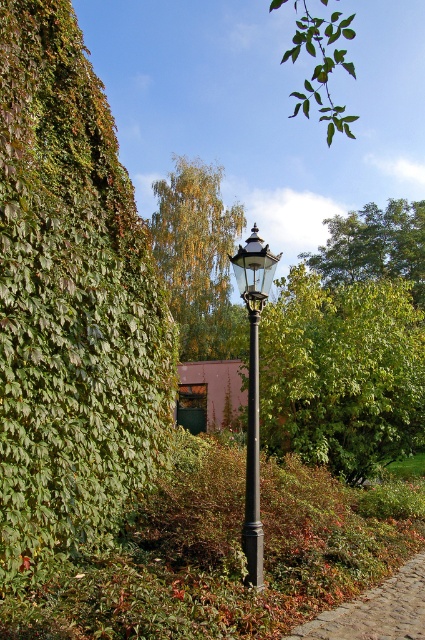
Based on the photo, between green leafy tree at center and yellow-green leaves at upper center, which one appears on the left side from the viewer's perspective?

Positioned to the left is yellow-green leaves at upper center.

Is the position of green leafy tree at center more distant than that of yellow-green leaves at upper center?

That is True.

The width and height of the screenshot is (425, 640). In order to click on green leafy tree at center in this screenshot , I will do `click(342, 372)`.

Based on the photo, does cobblestone pavement at lower right appear on the right side of black metal street light at center?

Indeed, cobblestone pavement at lower right is positioned on the right side of black metal street light at center.

Locate an element on the screen. cobblestone pavement at lower right is located at coordinates click(x=376, y=611).

Locate an element on the screen. The width and height of the screenshot is (425, 640). cobblestone pavement at lower right is located at coordinates (376, 611).

Between point (405, 221) and point (272, 266), which one is positioned in front?

Positioned in front is point (272, 266).

Can you confirm if green leafy tree at upper center is positioned above black metal street light at center?

Yes.

Is point (410, 260) in front of point (255, 486)?

No, (410, 260) is further to viewer.

Locate an element on the screen. The height and width of the screenshot is (640, 425). green leafy tree at upper center is located at coordinates (376, 244).